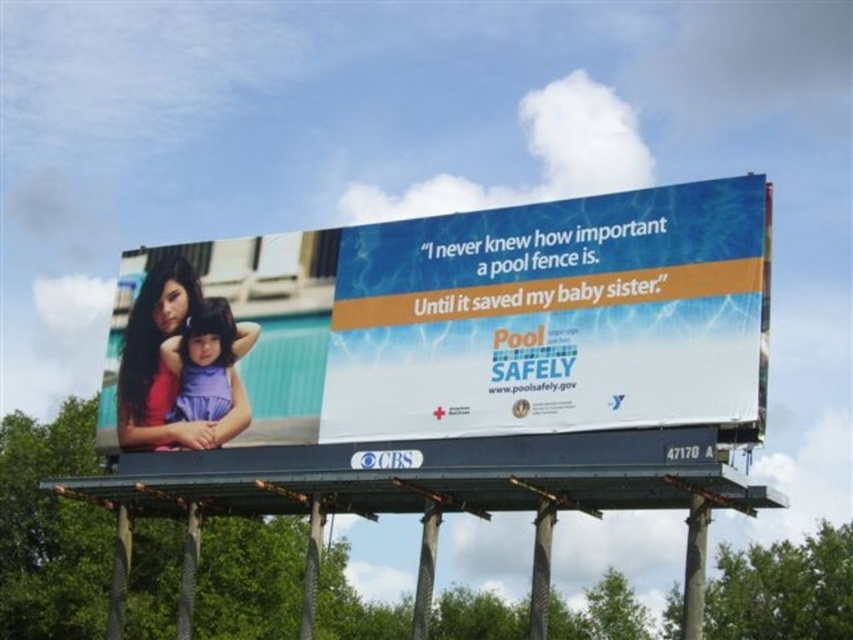
Does matte white billboard at center have a larger size compared to purple fabric at left?

Indeed, matte white billboard at center has a larger size compared to purple fabric at left.

Is matte white billboard at center above purple fabric at left?

Yes, matte white billboard at center is above purple fabric at left.

Between point (432, 289) and point (236, 385), which one is positioned behind?

Positioned behind is point (236, 385).

You are a GUI agent. You are given a task and a screenshot of the screen. Output one action in this format:
    pyautogui.click(x=<x>, y=<y>)
    Task: Click on the matte white billboard at center
    Image resolution: width=853 pixels, height=640 pixels.
    Given the screenshot: What is the action you would take?
    pyautogui.click(x=498, y=317)